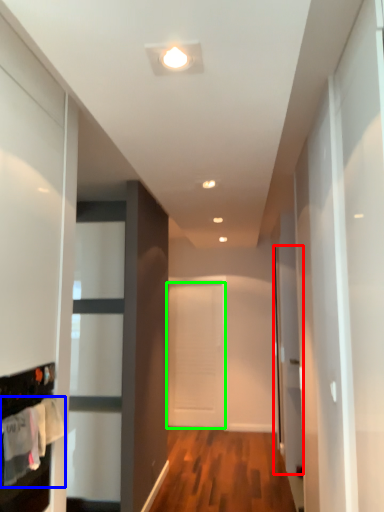
Question: Considering the real-world distances, which object is farthest from glass door (highlighted by a red box)? laundry (highlighted by a blue box) or door (highlighted by a green box)?

Choices:
 (A) laundry
 (B) door

Answer: (A)